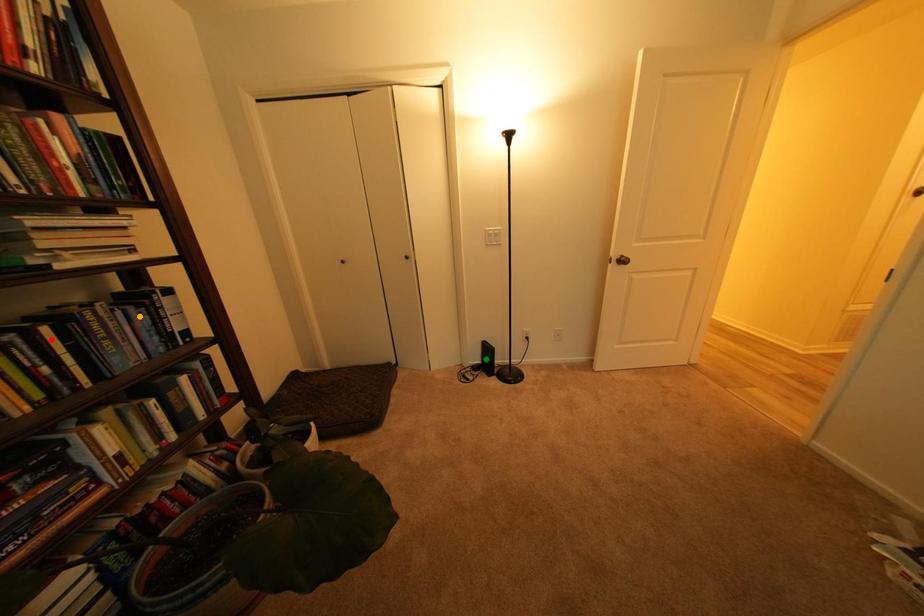
Order these from farthest to nearest:
orange point, green point, red point

green point → orange point → red point